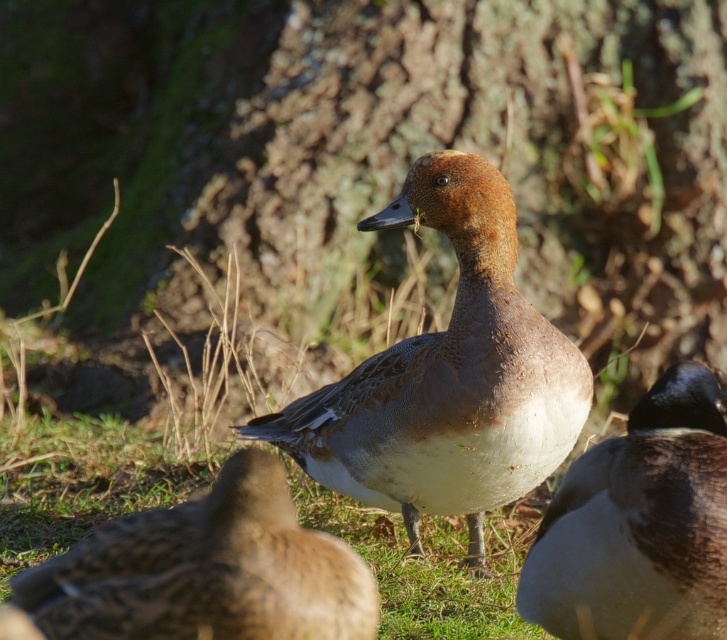
Question: Is brown feathered duck at center wider than brown matte duck at center?

Choices:
 (A) yes
 (B) no

Answer: (A)

Question: Which object is the farthest from the brown speckled duck at center?

Choices:
 (A) brown matte duck at center
 (B) brown feathered duck at center

Answer: (B)

Question: Which object is the closest to the brown speckled duck at center?

Choices:
 (A) brown feathered duck at center
 (B) brown matte duck at center

Answer: (B)

Question: Is brown feathered duck at center wider than brown speckled duck at center?

Choices:
 (A) yes
 (B) no

Answer: (A)

Question: Among these points, which one is nearest to the camera?

Choices:
 (A) (507, 448)
 (B) (116, 621)
 (C) (590, 538)

Answer: (B)

Question: Can you confirm if brown speckled duck at center is positioned below brown matte duck at center?

Choices:
 (A) yes
 (B) no

Answer: (B)